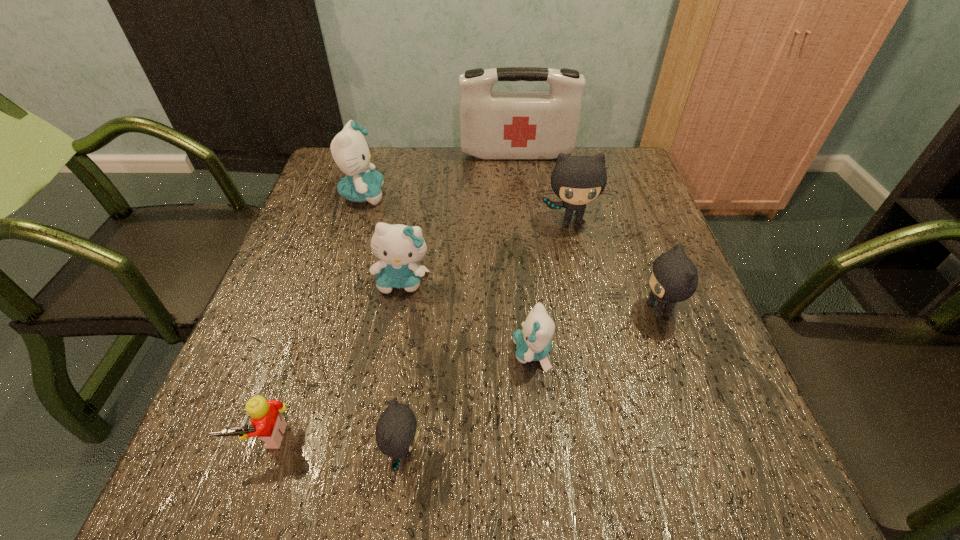
At what (x,y) coordinates should I click in order to perform the action: click on the farthest object. Please return your answer as a coordinate pair (x, y). This screenshot has width=960, height=540. Looking at the image, I should click on (493, 125).

You are a GUI agent. You are given a task and a screenshot of the screen. Output one action in this format:
    pyautogui.click(x=<x>, y=<y>)
    Task: Click on the first-aid kit
    
    Given the screenshot: What is the action you would take?
    pyautogui.click(x=493, y=125)

Find the location of a particular element. The image size is (960, 540). the leftmost kitten is located at coordinates (350, 151).

At what (x,y) coordinates should I click in order to perform the action: click on the biggest blue kitten. Please return your answer as a coordinate pair (x, y). The image size is (960, 540). Looking at the image, I should click on (350, 151).

Locate an element on the screen. the biggest gray kitten is located at coordinates (577, 180).

What are the coordinates of `the farthest gray kitten` in the screenshot? It's located at (577, 180).

Image resolution: width=960 pixels, height=540 pixels. I want to click on the second blue kitten from left to right, so click(398, 246).

The height and width of the screenshot is (540, 960). I want to click on the second smallest blue kitten, so click(398, 246).

Image resolution: width=960 pixels, height=540 pixels. In order to click on the second smallest gray kitten in this screenshot , I will do `click(674, 278)`.

Where is `the rightmost kitten`? The width and height of the screenshot is (960, 540). the rightmost kitten is located at coordinates (674, 278).